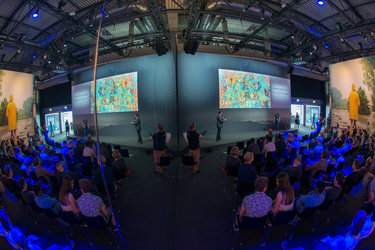
Where is `floor`? This screenshot has height=250, width=375. floor is located at coordinates (157, 203), (195, 209).